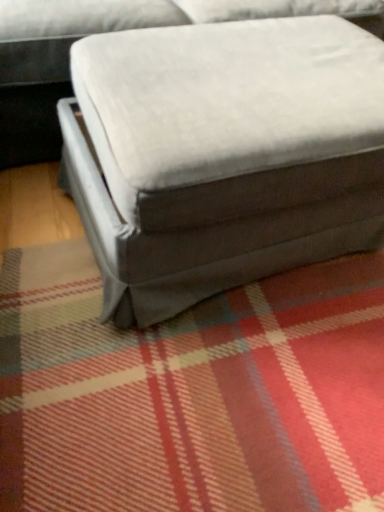
Question: Can you confirm if velvet gray ottoman at center is positioned to the left of velvet gray bean bag chair at center?

Choices:
 (A) no
 (B) yes

Answer: (B)

Question: Is velvet gray ottoman at center oriented away from velvet gray bean bag chair at center?

Choices:
 (A) no
 (B) yes

Answer: (A)

Question: From the image's perspective, is velvet gray ottoman at center on top of velvet gray bean bag chair at center?

Choices:
 (A) no
 (B) yes

Answer: (B)

Question: Are velvet gray ottoman at center and velvet gray bean bag chair at center far apart?

Choices:
 (A) yes
 (B) no

Answer: (B)

Question: Does velvet gray ottoman at center lie in front of velvet gray bean bag chair at center?

Choices:
 (A) yes
 (B) no

Answer: (B)

Question: Does velvet gray ottoman at center appear on the right side of velvet gray bean bag chair at center?

Choices:
 (A) yes
 (B) no

Answer: (B)

Question: Is velvet gray bean bag chair at center not within velvet gray ottoman at center?

Choices:
 (A) yes
 (B) no

Answer: (A)

Question: Considering the relative sizes of velvet gray bean bag chair at center and velvet gray ottoman at center in the image provided, is velvet gray bean bag chair at center taller than velvet gray ottoman at center?

Choices:
 (A) no
 (B) yes

Answer: (A)

Question: Is velvet gray bean bag chair at center positioned in front of velvet gray ottoman at center?

Choices:
 (A) yes
 (B) no

Answer: (A)

Question: From the image's perspective, is velvet gray bean bag chair at center over velvet gray ottoman at center?

Choices:
 (A) yes
 (B) no

Answer: (B)

Question: Is velvet gray bean bag chair at center smaller than velvet gray ottoman at center?

Choices:
 (A) no
 (B) yes

Answer: (B)

Question: Is velvet gray bean bag chair at center looking in the opposite direction of velvet gray ottoman at center?

Choices:
 (A) no
 (B) yes

Answer: (B)

Question: Is velvet gray ottoman at center inside the boundaries of velvet gray bean bag chair at center, or outside?

Choices:
 (A) outside
 (B) inside

Answer: (A)